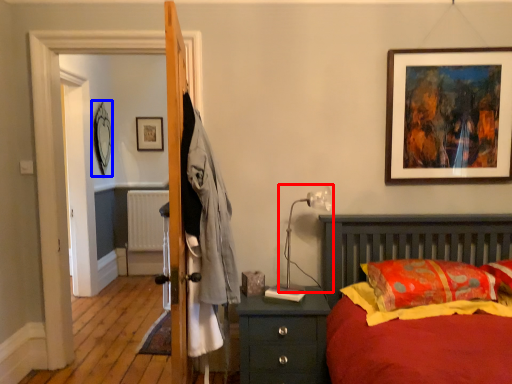
Question: Which point is closer to the camera, table lamp (highlighted by a red box) or picture frame (highlighted by a blue box)?

Choices:
 (A) table lamp
 (B) picture frame

Answer: (A)